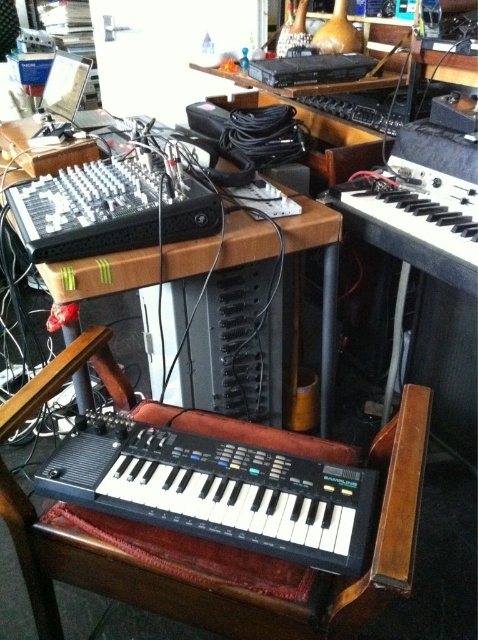
Is black plastic keyboard at lower center below wooden table at center?

Yes, black plastic keyboard at lower center is below wooden table at center.

Who is taller, black plastic keyboard at lower center or wooden table at center?

With more height is wooden table at center.

Is point (130, 499) positioned in front of point (234, 248)?

Yes, it is in front of point (234, 248).

Locate an element on the screen. Image resolution: width=478 pixels, height=640 pixels. black plastic keyboard at lower center is located at coordinates (218, 492).

Can you confirm if black plastic keyboard at lower center is positioned below black plastic keyboard at right?

Yes, black plastic keyboard at lower center is below black plastic keyboard at right.

Is black plastic keyboard at lower center further to camera compared to black plastic keyboard at right?

No.

Between point (73, 433) and point (475, 212), which one is positioned in front?

Point (73, 433) is in front.

The height and width of the screenshot is (640, 478). In order to click on black plastic keyboard at lower center in this screenshot , I will do `click(218, 492)`.

Is point (223, 253) farther from camera compared to point (378, 225)?

No, it is not.

Locate an element on the screen. This screenshot has width=478, height=640. wooden table at center is located at coordinates (162, 260).

Is point (123, 268) less distant than point (474, 189)?

Yes, it is in front of point (474, 189).

In order to click on wooden table at center in this screenshot , I will do `click(162, 260)`.